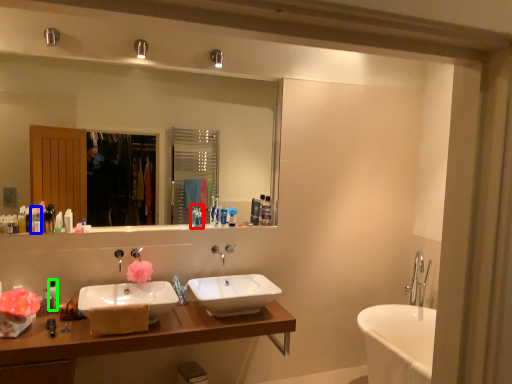
Question: Which object is the farthest from toiletry (highlighted by a red box)? Choose among these: toiletry (highlighted by a blue box) or toiletry (highlighted by a green box).

Choices:
 (A) toiletry
 (B) toiletry

Answer: (A)